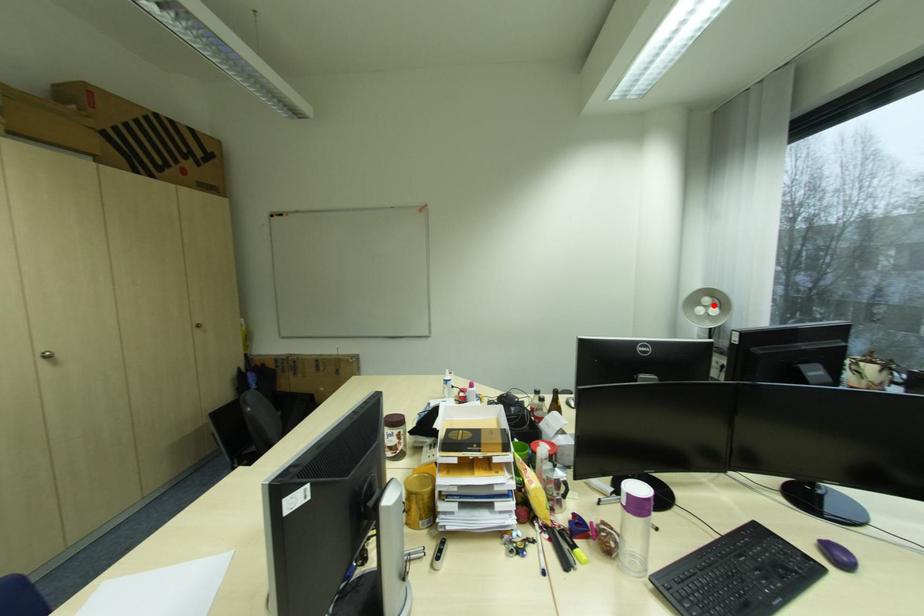
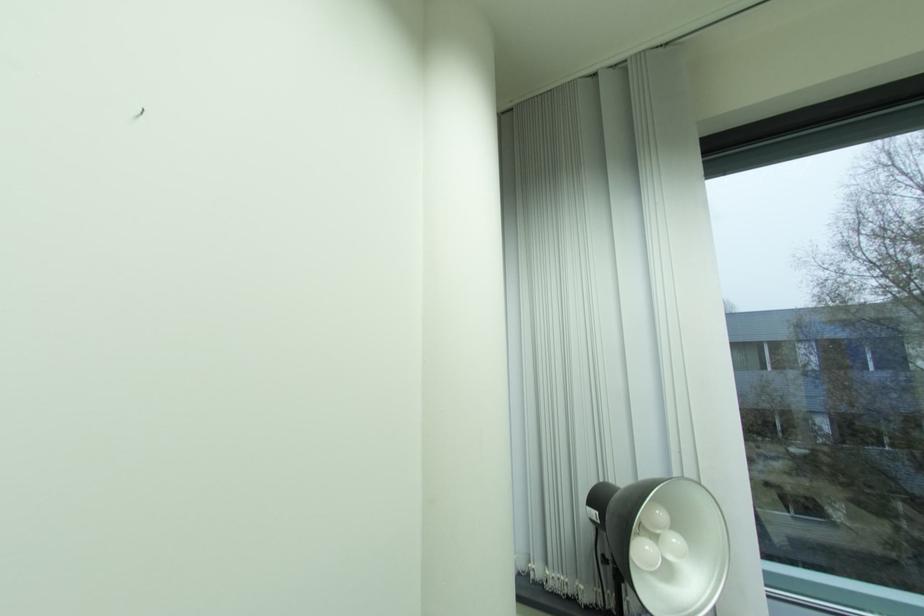
In the second image, find the point that corresponds to the highlighted location in the first image.

(665, 531)